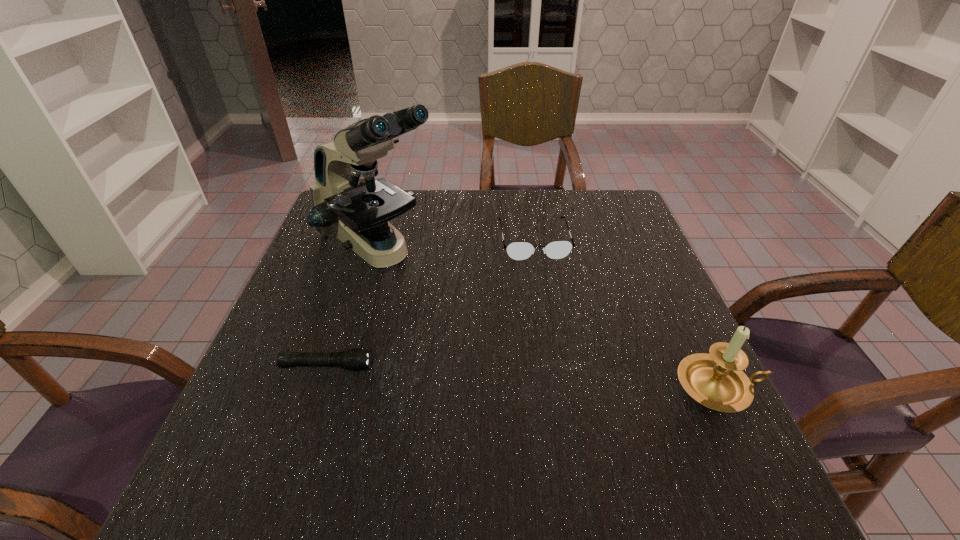
You are a GUI agent. You are given a task and a screenshot of the screen. Output one action in this format:
    pyautogui.click(x=<x>, y=<y>)
    Task: Click on the free region that satisfies the following two spatial constraints: 1. on the back side of the microscope; 2. on the left side of the second shortest object
    
    Given the screenshot: What is the action you would take?
    pyautogui.click(x=379, y=240)

The height and width of the screenshot is (540, 960). What are the coordinates of `vacant region that satisfies the following two spatial constraints: 1. on the front side of the rightmost object; 2. with a handle on the side of the spectacles` in the screenshot? It's located at (556, 387).

This screenshot has width=960, height=540. Find the location of `free space that satisfies the following two spatial constraints: 1. on the front side of the microscope; 2. with a handle on the side of the second tallest object`. free space that satisfies the following two spatial constraints: 1. on the front side of the microscope; 2. with a handle on the side of the second tallest object is located at coordinates (336, 387).